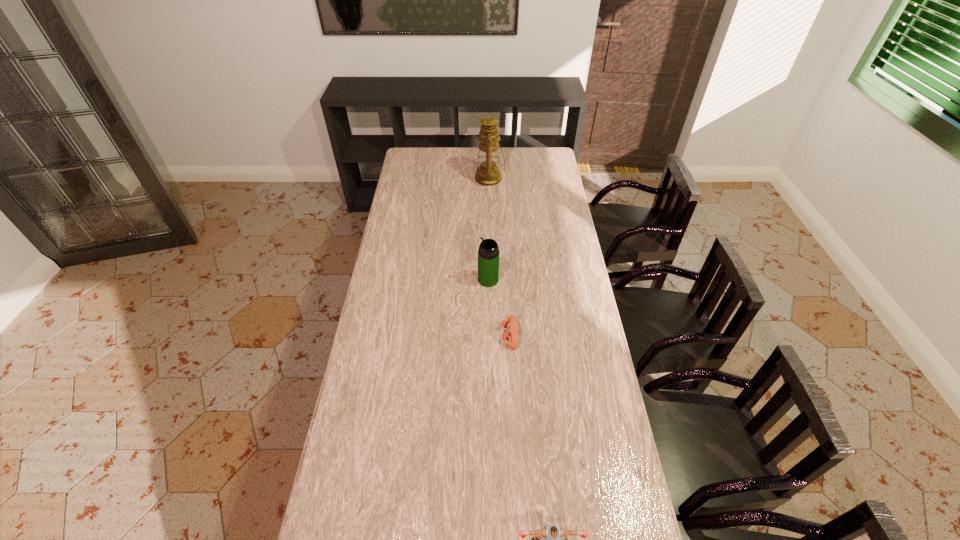
At what (x,y) coordinates should I click in order to perform the action: click on oil lamp. Please return your answer as a coordinate pair (x, y). The width and height of the screenshot is (960, 540). Looking at the image, I should click on (488, 174).

You are a GUI agent. You are given a task and a screenshot of the screen. Output one action in this format:
    pyautogui.click(x=<x>, y=<y>)
    Task: Click on the tallest object
    The height and width of the screenshot is (540, 960).
    Given the screenshot: What is the action you would take?
    pyautogui.click(x=488, y=174)

Where is `the second tallest object`? the second tallest object is located at coordinates (488, 253).

Locate an element on the screen. the third nearest object is located at coordinates (488, 253).

Identify the location of the shorter puncher. (x=512, y=327).

At what (x,y) coordinates should I click in order to perform the action: click on the third farthest object. Please return your answer as a coordinate pair (x, y). Looking at the image, I should click on (512, 327).

Locate an element on the screen. The image size is (960, 540). vacant space situated on the right of the oil lamp is located at coordinates (533, 178).

Locate an element on the screen. vacant position located 0.370m from the spout of the third nearest object is located at coordinates (389, 280).

I want to click on vacant space positioned 0.310m from the spout of the third nearest object, so click(x=403, y=280).

The image size is (960, 540). I want to click on free space located from the spout of the third nearest object, so click(415, 280).